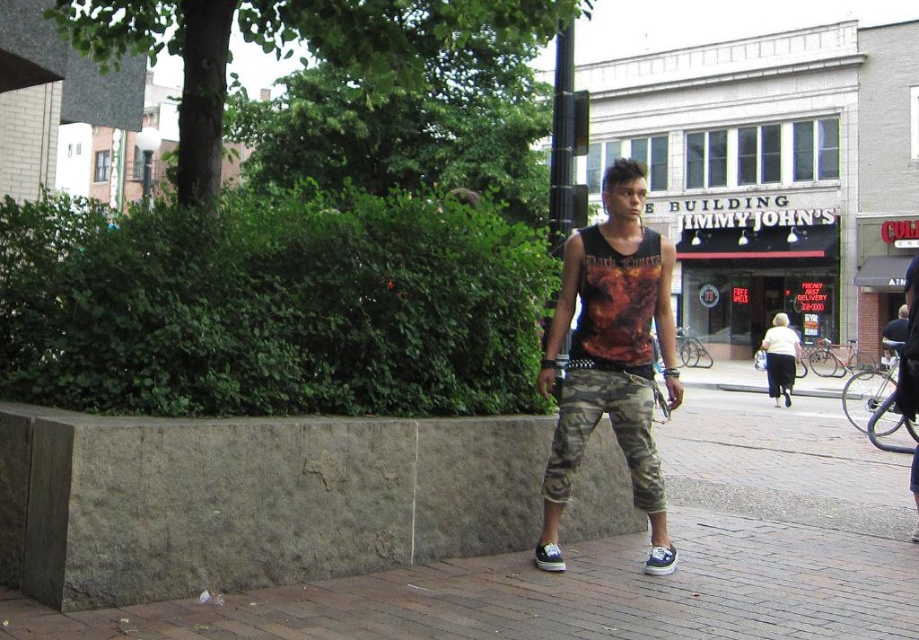
Question: Considering the relative positions of gray concrete pavement at center and printed fabric tank top at center in the image provided, where is gray concrete pavement at center located with respect to printed fabric tank top at center?

Choices:
 (A) below
 (B) above

Answer: (A)

Question: Which point is farther from the camera taking this photo?

Choices:
 (A) (603, 541)
 (B) (666, 257)

Answer: (A)

Question: Considering the relative positions of gray concrete pavement at center and printed fabric tank top at center in the image provided, where is gray concrete pavement at center located with respect to printed fabric tank top at center?

Choices:
 (A) left
 (B) right

Answer: (B)

Question: Which point is closer to the camera?

Choices:
 (A) (630, 396)
 (B) (844, 496)

Answer: (A)

Question: Which object is farther from the camera taking this photo?

Choices:
 (A) gray concrete pavement at center
 (B) printed fabric tank top at center

Answer: (B)

Question: Does gray concrete pavement at center have a smaller size compared to printed fabric tank top at center?

Choices:
 (A) yes
 (B) no

Answer: (B)